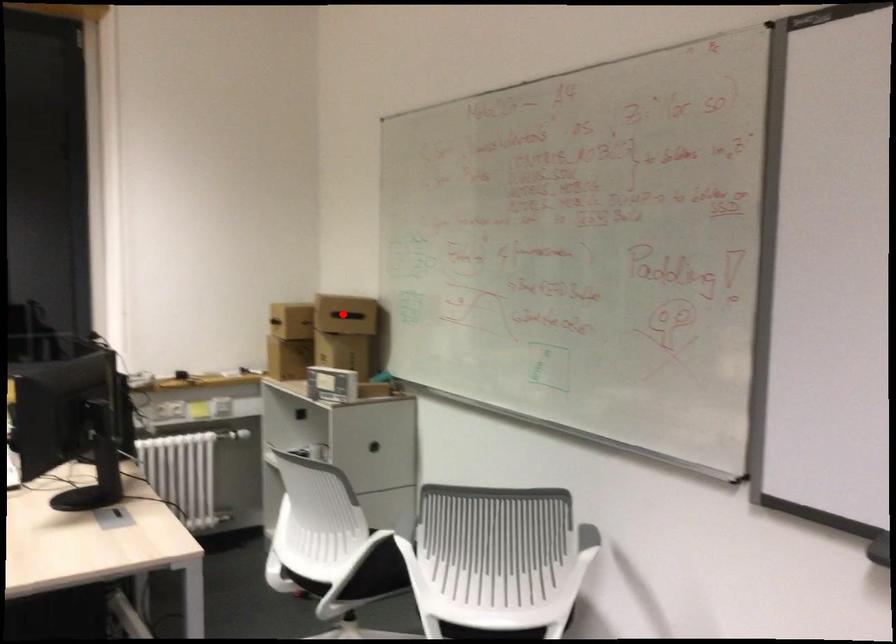
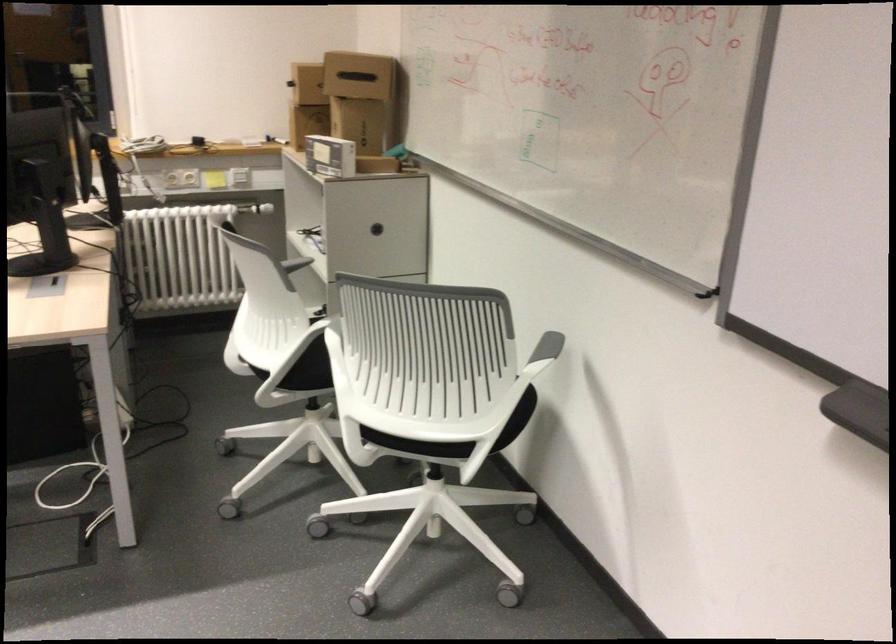
Where in the second image is the point corresponding to the highlighted location from the first image?

(357, 76)